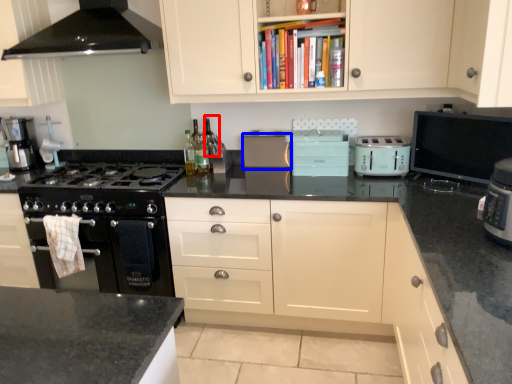
Question: Which point is closer to the camera, wine bottle (highlighted by a red box) or appliance (highlighted by a blue box)?

Choices:
 (A) wine bottle
 (B) appliance

Answer: (B)